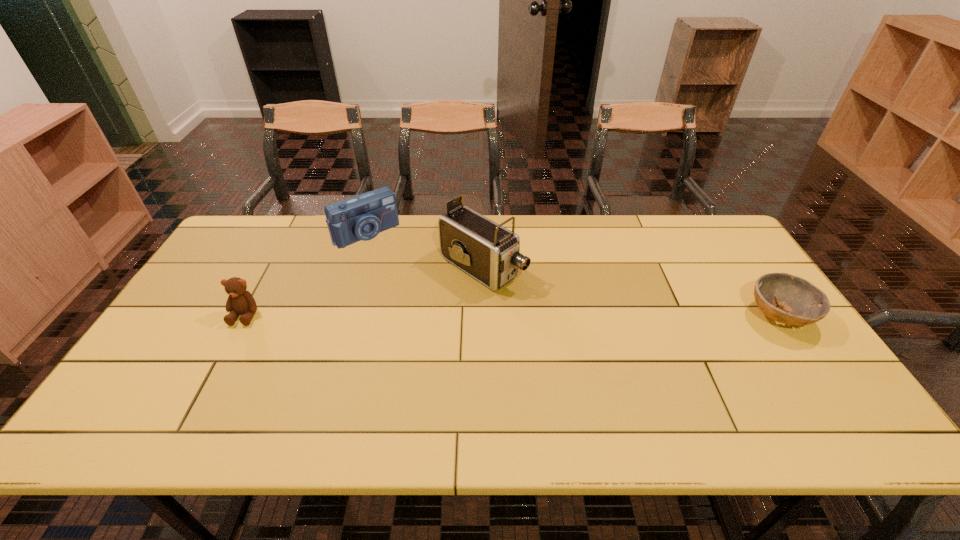
In the image, there is a desktop. Identify the location of vacant space at the right edge. (738, 286).

Locate an element on the screen. The width and height of the screenshot is (960, 540). vacant space at the far left corner of the desktop is located at coordinates (252, 238).

Identify the location of free space at the far right corner of the desktop. (698, 216).

Identify the location of free location at the near right corner. (804, 397).

Image resolution: width=960 pixels, height=540 pixels. Identify the location of free area in between the shortest object and the third object from right to left. (572, 274).

Identify the location of empty location between the third object from right to left and the second object from right to left. The width and height of the screenshot is (960, 540). (424, 250).

Locate an element on the screen. This screenshot has width=960, height=540. free space between the camcorder and the leftmost object is located at coordinates (364, 291).

This screenshot has height=540, width=960. What are the coordinates of `vacant space that's between the tallest object and the bowl` in the screenshot? It's located at (631, 292).

Identify the location of free space between the teddy bear and the camera. The image size is (960, 540). (305, 274).

You are a GUI agent. You are given a task and a screenshot of the screen. Output one action in this format:
    pyautogui.click(x=<x>, y=<y>)
    Task: Click on the free space between the camcorder and the third object from right to left
    The height and width of the screenshot is (540, 960).
    Given the screenshot: What is the action you would take?
    pyautogui.click(x=424, y=250)